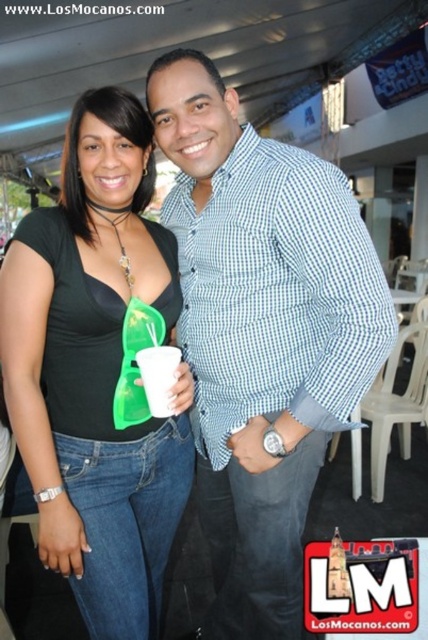
Question: Which is farther from the black matte top at center?

Choices:
 (A) white paper cup at center
 (B) blue checkered shirt at center

Answer: (A)

Question: Is black matte top at center below white paper cup at center?

Choices:
 (A) no
 (B) yes

Answer: (B)

Question: In this image, where is black matte top at center located relative to white paper cup at center?

Choices:
 (A) below
 (B) above

Answer: (A)

Question: Can you confirm if blue checkered shirt at center is bigger than white paper cup at center?

Choices:
 (A) yes
 (B) no

Answer: (A)

Question: Which point is farther to the camera?

Choices:
 (A) (279, 470)
 (B) (154, 381)
 (C) (80, 204)

Answer: (C)

Question: Which object is positioned closest to the blue checkered shirt at center?

Choices:
 (A) black matte top at center
 (B) white paper cup at center

Answer: (A)